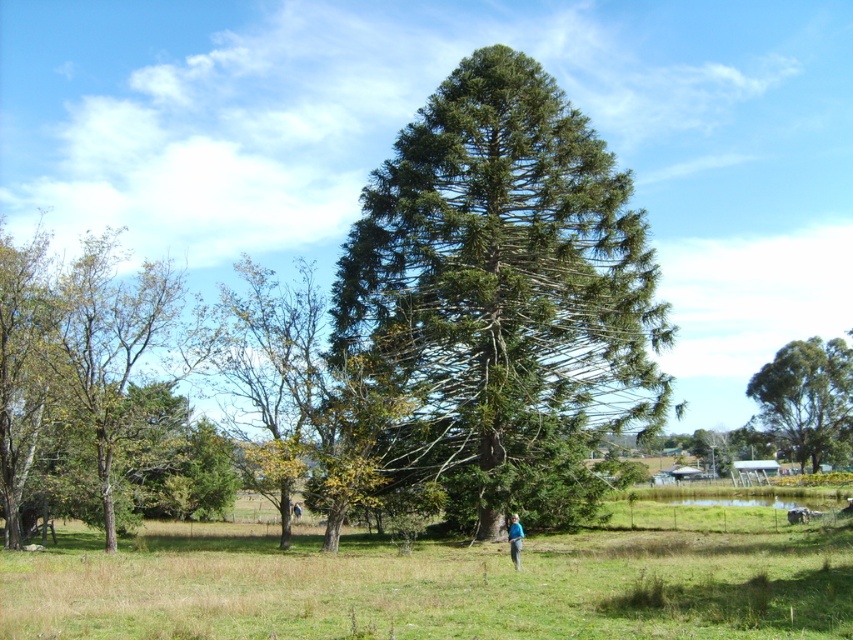
Question: Which object is closer to the camera taking this photo?

Choices:
 (A) green leafy tree at right
 (B) blue fabric shirt at center
 (C) green leafy tree at left

Answer: (C)

Question: Which object is positioned farthest from the green leafy tree at left?

Choices:
 (A) green textured tree at center
 (B) blue fabric shirt at center
 (C) blue fabric shirt at lower center

Answer: (C)

Question: Which of the following is the closest to the observer?

Choices:
 (A) green leafy tree at right
 (B) green textured tree at center
 (C) green leafy grass at center
 (D) blue fabric shirt at center

Answer: (C)

Question: Can you confirm if green leafy grass at center is smaller than blue fabric shirt at lower center?

Choices:
 (A) yes
 (B) no

Answer: (B)

Question: Does green leafy tree at left have a lesser width compared to green leafy tree at right?

Choices:
 (A) no
 (B) yes

Answer: (A)

Question: Observing the image, what is the correct spatial positioning of green leafy grass at center in reference to green leafy tree at right?

Choices:
 (A) right
 (B) left

Answer: (B)